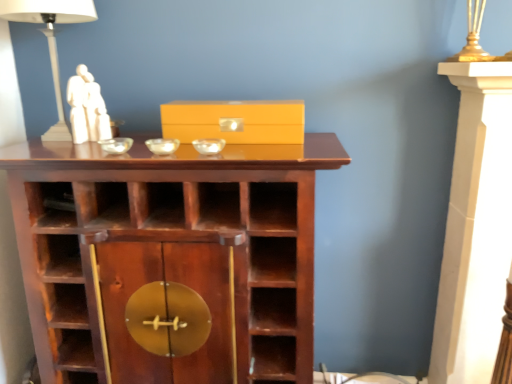
Question: Is transparent glass bowl at center, which appears as the second glass bowl when viewed from the left, smaller than matte yellow box at center?

Choices:
 (A) yes
 (B) no

Answer: (A)

Question: Considering the relative positions of transparent glass bowl at center, which is the 2th glass bowl in right-to-left order, and matte yellow box at center in the image provided, is transparent glass bowl at center, which is the 2th glass bowl in right-to-left order, to the left of matte yellow box at center from the viewer's perspective?

Choices:
 (A) no
 (B) yes

Answer: (B)

Question: From the image's perspective, is transparent glass bowl at center, which appears as the second glass bowl when viewed from the left, above matte yellow box at center?

Choices:
 (A) no
 (B) yes

Answer: (A)

Question: Is matte yellow box at center a part of transparent glass bowl at center, which appears as the second glass bowl when viewed from the left?

Choices:
 (A) yes
 (B) no

Answer: (B)

Question: From a real-world perspective, does transparent glass bowl at center, which appears as the second glass bowl when viewed from the left, sit lower than matte yellow box at center?

Choices:
 (A) no
 (B) yes

Answer: (B)

Question: In terms of size, does white ceramic table lamp at upper left appear bigger or smaller than matte yellow box at center?

Choices:
 (A) small
 (B) big

Answer: (B)

Question: From a real-world perspective, relative to matte yellow box at center, is white ceramic table lamp at upper left vertically above or below?

Choices:
 (A) above
 (B) below

Answer: (A)

Question: In the image, is white ceramic table lamp at upper left on the left side or the right side of matte yellow box at center?

Choices:
 (A) left
 (B) right

Answer: (A)

Question: Looking at their shapes, would you say white ceramic table lamp at upper left is wider or thinner than matte yellow box at center?

Choices:
 (A) thin
 (B) wide

Answer: (B)

Question: Visually, is brown wood shelf at center positioned to the left or to the right of transparent glass bowl at center, the third glass bowl in the left-to-right sequence?

Choices:
 (A) right
 (B) left

Answer: (B)

Question: Looking at the image, does brown wood shelf at center seem bigger or smaller compared to transparent glass bowl at center, positioned as the first glass bowl in right-to-left order?

Choices:
 (A) small
 (B) big

Answer: (B)

Question: Is brown wood shelf at center inside or outside of transparent glass bowl at center, the third glass bowl in the left-to-right sequence?

Choices:
 (A) inside
 (B) outside

Answer: (B)

Question: Is brown wood shelf at center in front of or behind transparent glass bowl at center, positioned as the first glass bowl in right-to-left order, in the image?

Choices:
 (A) behind
 (B) front

Answer: (B)

Question: Is white marble statue at upper left bigger or smaller than brown wood shelf at center?

Choices:
 (A) big
 (B) small

Answer: (B)

Question: Is white marble statue at upper left in front of or behind brown wood shelf at center in the image?

Choices:
 (A) front
 (B) behind

Answer: (B)